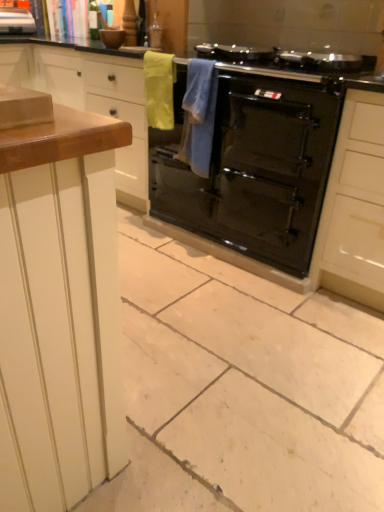
Question: Is yellow fabric towel at upper center, the second material positioned from the right, next to blue towel at center, arranged as the 1th material when viewed from the right, and touching it?

Choices:
 (A) no
 (B) yes

Answer: (A)

Question: From the image's perspective, would you say yellow fabric towel at upper center, the second material positioned from the right, is positioned over blue towel at center, arranged as the 1th material when viewed from the right?

Choices:
 (A) no
 (B) yes

Answer: (B)

Question: Does yellow fabric towel at upper center, the second material positioned from the right, have a lesser height compared to blue towel at center, which ranks as the second material in left-to-right order?

Choices:
 (A) yes
 (B) no

Answer: (A)

Question: Is blue towel at center, which ranks as the second material in left-to-right order, a part of yellow fabric towel at upper center, the second material positioned from the right?

Choices:
 (A) yes
 (B) no

Answer: (B)

Question: Is yellow fabric towel at upper center, the second material positioned from the right, taller than blue towel at center, arranged as the 1th material when viewed from the right?

Choices:
 (A) no
 (B) yes

Answer: (A)

Question: In the image, is metallic silver toaster at upper left positioned in front of or behind blue towel at center, which ranks as the second material in left-to-right order?

Choices:
 (A) behind
 (B) front

Answer: (A)

Question: Considering the positions of point (8, 30) and point (206, 111), is point (8, 30) closer or farther from the camera than point (206, 111)?

Choices:
 (A) closer
 (B) farther

Answer: (B)

Question: From a real-world perspective, is metallic silver toaster at upper left physically located above or below blue towel at center, which ranks as the second material in left-to-right order?

Choices:
 (A) above
 (B) below

Answer: (A)

Question: Considering the positions of metallic silver toaster at upper left and blue towel at center, which ranks as the second material in left-to-right order, in the image, is metallic silver toaster at upper left wider or thinner than blue towel at center, which ranks as the second material in left-to-right order,?

Choices:
 (A) wide
 (B) thin

Answer: (A)

Question: In terms of width, does wooden countertop at left look wider or thinner when compared to black glossy oven at center?

Choices:
 (A) wide
 (B) thin

Answer: (B)

Question: Is point click(120, 195) positioned closer to the camera than point click(150, 181)?

Choices:
 (A) farther
 (B) closer

Answer: (A)

Question: In terms of height, does wooden countertop at left look taller or shorter compared to black glossy oven at center?

Choices:
 (A) short
 (B) tall

Answer: (B)

Question: Is wooden countertop at left bigger or smaller than black glossy oven at center?

Choices:
 (A) big
 (B) small

Answer: (A)

Question: From a real-world perspective, relative to black glossy oven at center, is metallic silver toaster at upper left vertically above or below?

Choices:
 (A) below
 (B) above

Answer: (B)

Question: From the image's perspective, is metallic silver toaster at upper left positioned above or below black glossy oven at center?

Choices:
 (A) above
 (B) below

Answer: (A)